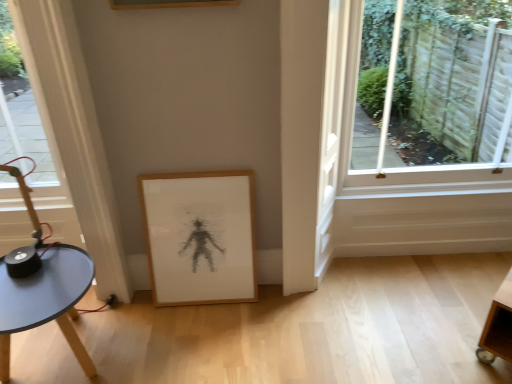
Identify the location of clear glass window at upper right. (426, 91).

The width and height of the screenshot is (512, 384). Describe the element at coordinates (46, 300) in the screenshot. I see `matte blue table at lower left` at that location.

This screenshot has width=512, height=384. In order to click on wooden picture frame at lower center in this screenshot , I will do `click(200, 236)`.

The width and height of the screenshot is (512, 384). Find the location of `clear glass window at upper right`. clear glass window at upper right is located at coordinates (426, 91).

Is the depth of wooden picture frame at lower center greater than that of clear glass window at upper right?

That is True.

Who is taller, wooden picture frame at lower center or clear glass window at upper right?

Standing taller between the two is clear glass window at upper right.

Which is in front, point (164, 271) or point (454, 175)?

The point (164, 271) is closer to the camera.

From a real-world perspective, which is physically below, wooden picture frame at lower center or clear glass window at upper right?

wooden picture frame at lower center is physically lower.

Where is `picture frame on the left of clear glass window at upper right`? The height and width of the screenshot is (384, 512). picture frame on the left of clear glass window at upper right is located at coordinates (200, 236).

Considering their positions, is clear glass window at upper right located in front of or behind wooden picture frame at lower center?

clear glass window at upper right is in front of wooden picture frame at lower center.

From a real-world perspective, is clear glass window at upper right beneath wooden picture frame at lower center?

No, from a real-world perspective, clear glass window at upper right is not under wooden picture frame at lower center.

Is clear glass window at upper right spatially inside wooden picture frame at lower center, or outside of it?

clear glass window at upper right is not inside wooden picture frame at lower center, it's outside.

Consider the image. Is the position of matte blue table at lower left less distant than that of wooden picture frame at lower center?

Yes, the depth of matte blue table at lower left is less than that of wooden picture frame at lower center.

From a real-world perspective, is matte blue table at lower left positioned under wooden picture frame at lower center based on gravity?

Yes, from a real-world perspective, matte blue table at lower left is below wooden picture frame at lower center.

Does matte blue table at lower left have a greater width compared to wooden picture frame at lower center?

Indeed, matte blue table at lower left has a greater width compared to wooden picture frame at lower center.

Is wooden picture frame at lower center at the back of matte blue table at lower left?

No, matte blue table at lower left's orientation is not away from wooden picture frame at lower center.

Does clear glass window at upper right have a larger size compared to matte blue table at lower left?

Yes, clear glass window at upper right is bigger than matte blue table at lower left.

From the image's perspective, does clear glass window at upper right appear lower than matte blue table at lower left?

No.

Considering the relative sizes of clear glass window at upper right and matte blue table at lower left in the image provided, is clear glass window at upper right thinner than matte blue table at lower left?

Correct, the width of clear glass window at upper right is less than that of matte blue table at lower left.

Is clear glass window at upper right facing away from matte blue table at lower left?

clear glass window at upper right does not have its back to matte blue table at lower left.

Measure the distance from matte blue table at lower left to clear glass window at upper right.

12.83 feet.

Is point (51, 254) in front of point (440, 90)?

Yes, point (51, 254) is closer to viewer.

Can you confirm if matte blue table at lower left is shorter than clear glass window at upper right?

Correct, matte blue table at lower left is not as tall as clear glass window at upper right.

Between matte blue table at lower left and clear glass window at upper right, which one has smaller width?

Thinner between the two is clear glass window at upper right.

Are wooden picture frame at lower center and matte blue table at lower left located far from each other?

No, wooden picture frame at lower center is in close proximity to matte blue table at lower left.

From a real-world perspective, between wooden picture frame at lower center and matte blue table at lower left, who is vertically higher?

From a 3D spatial view, wooden picture frame at lower center is above.

Does wooden picture frame at lower center have a larger size compared to matte blue table at lower left?

Incorrect, wooden picture frame at lower center is not larger than matte blue table at lower left.

At what (x,y) coordinates should I click in order to perform the action: click on table below the wooden picture frame at lower center (from a real-world perspective). Please return your answer as a coordinate pair (x, y). Looking at the image, I should click on (46, 300).

The height and width of the screenshot is (384, 512). Find the location of `picture frame below the clear glass window at upper right (from the image's perspective)`. picture frame below the clear glass window at upper right (from the image's perspective) is located at coordinates (200, 236).

The image size is (512, 384). I want to click on picture frame beneath the clear glass window at upper right (from a real-world perspective), so (200, 236).

Based on the photo, when comparing their distances from clear glass window at upper right, does matte blue table at lower left or wooden picture frame at lower center seem further?

The object further to clear glass window at upper right is matte blue table at lower left.

Based on their spatial positions, is clear glass window at upper right or matte blue table at lower left closer to wooden picture frame at lower center?

The object closer to wooden picture frame at lower center is matte blue table at lower left.

Looking at the image, which one is located closer to wooden picture frame at lower center, matte blue table at lower left or clear glass window at upper right?

matte blue table at lower left.

When comparing their distances from matte blue table at lower left, does clear glass window at upper right or wooden picture frame at lower center seem closer?

wooden picture frame at lower center.

From the image, which object appears to be farther from matte blue table at lower left, wooden picture frame at lower center or clear glass window at upper right?

clear glass window at upper right is further to matte blue table at lower left.

In the scene shown: Estimate the real-world distances between objects in this image. Which object is further from clear glass window at upper right, wooden picture frame at lower center or matte blue table at lower left?

Among the two, matte blue table at lower left is located further to clear glass window at upper right.

Where is `picture frame between matte blue table at lower left and clear glass window at upper right from left to right`? This screenshot has width=512, height=384. picture frame between matte blue table at lower left and clear glass window at upper right from left to right is located at coordinates (200, 236).